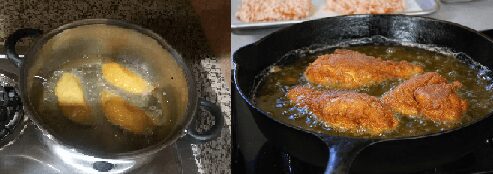
Where is `handle`? handle is located at coordinates (335, 163), (215, 128), (10, 48).